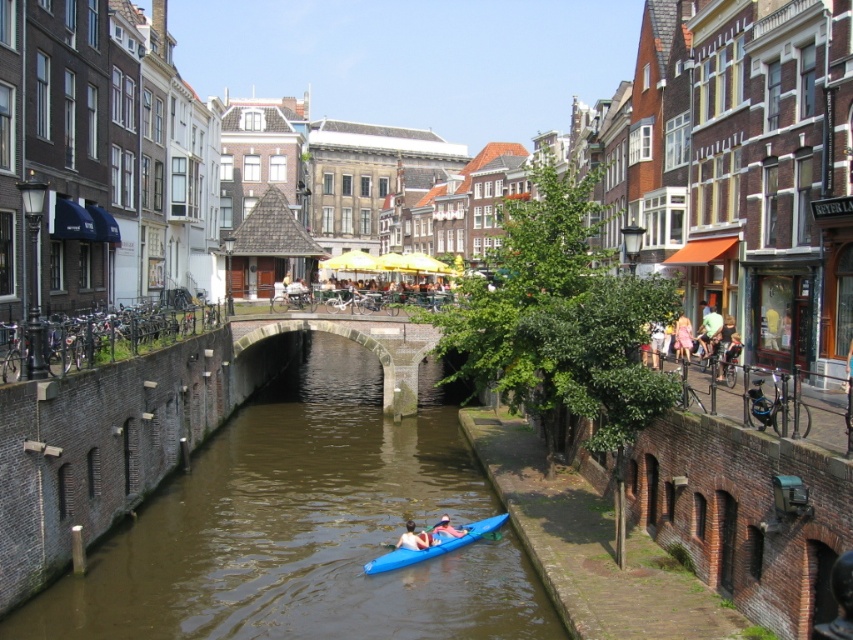
Question: Can you confirm if light blue fabric pants at center is positioned to the right of pink fabric kayak at lower center?

Choices:
 (A) no
 (B) yes

Answer: (B)

Question: Estimate the real-world distances between objects in this image. Which object is closer to the light blue kayak at lower center?

Choices:
 (A) light blue fabric pants at center
 (B) blue matte kayak at center

Answer: (B)

Question: Which point is farther from the camera taking this photo?

Choices:
 (A) (412, 545)
 (B) (490, 600)
 (C) (438, 524)

Answer: (C)

Question: Does blue fabric jacket at center have a larger size compared to light blue kayak at lower center?

Choices:
 (A) no
 (B) yes

Answer: (B)

Question: Which point is farther to the camera?

Choices:
 (A) (491, 524)
 (B) (144, 611)

Answer: (A)

Question: Does brown concrete river at center come in front of blue matte kayak at center?

Choices:
 (A) no
 (B) yes

Answer: (B)